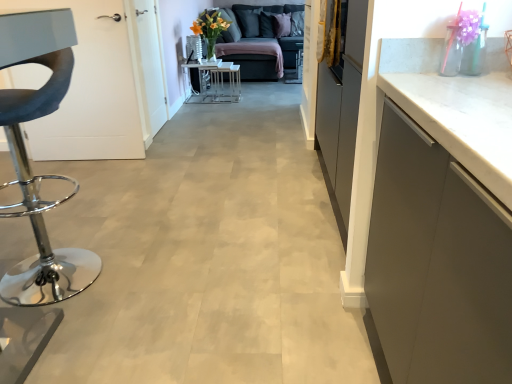
Question: Is the depth of dark gray fabric couch at upper center less than that of metallic chrome stool at left?

Choices:
 (A) no
 (B) yes

Answer: (A)

Question: Considering the relative positions of dark gray fabric couch at upper center and metallic chrome stool at left in the image provided, is dark gray fabric couch at upper center behind metallic chrome stool at left?

Choices:
 (A) yes
 (B) no

Answer: (A)

Question: Considering the relative sizes of dark gray fabric couch at upper center and metallic chrome stool at left in the image provided, is dark gray fabric couch at upper center wider than metallic chrome stool at left?

Choices:
 (A) yes
 (B) no

Answer: (A)

Question: From a real-world perspective, is dark gray fabric couch at upper center positioned over metallic chrome stool at left based on gravity?

Choices:
 (A) yes
 (B) no

Answer: (B)

Question: Does dark gray fabric couch at upper center appear on the right side of metallic chrome stool at left?

Choices:
 (A) no
 (B) yes

Answer: (B)

Question: Does dark gray fabric couch at upper center have a lesser width compared to metallic chrome stool at left?

Choices:
 (A) yes
 (B) no

Answer: (B)

Question: Does metallic chrome stool at left turn towards metallic silver table at center?

Choices:
 (A) no
 (B) yes

Answer: (A)

Question: Is metallic chrome stool at left completely or partially outside of metallic silver table at center?

Choices:
 (A) yes
 (B) no

Answer: (A)

Question: Is metallic chrome stool at left taller than metallic silver table at center?

Choices:
 (A) no
 (B) yes

Answer: (B)

Question: Is metallic chrome stool at left bigger than metallic silver table at center?

Choices:
 (A) no
 (B) yes

Answer: (B)

Question: Can you confirm if metallic chrome stool at left is thinner than metallic silver table at center?

Choices:
 (A) no
 (B) yes

Answer: (A)

Question: Does metallic chrome stool at left have a smaller size compared to metallic silver table at center?

Choices:
 (A) no
 (B) yes

Answer: (A)

Question: From a real-world perspective, is dark gray fabric couch at upper center physically below metallic silver table at center?

Choices:
 (A) no
 (B) yes

Answer: (A)